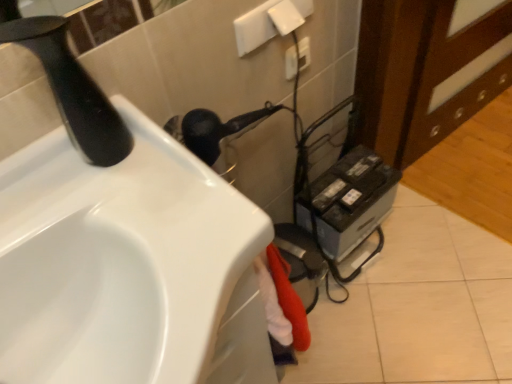
Question: From the image's perspective, is black matte faucet at upper left above white plastic electric outlet at upper center?

Choices:
 (A) yes
 (B) no

Answer: (B)

Question: From a real-world perspective, is black matte faucet at upper left located higher than white plastic electric outlet at upper center?

Choices:
 (A) no
 (B) yes

Answer: (B)

Question: Is black matte faucet at upper left looking in the opposite direction of white plastic electric outlet at upper center?

Choices:
 (A) yes
 (B) no

Answer: (B)

Question: Is the depth of black matte faucet at upper left less than that of white plastic electric outlet at upper center?

Choices:
 (A) no
 (B) yes

Answer: (B)

Question: Is black matte faucet at upper left to the left of white plastic electric outlet at upper center from the viewer's perspective?

Choices:
 (A) yes
 (B) no

Answer: (A)

Question: Would you say black matte faucet at upper left is a long distance from white plastic electric outlet at upper center?

Choices:
 (A) yes
 (B) no

Answer: (B)

Question: Considering the relative sizes of metallic gray printer at lower right and white glossy sink at lower left in the image provided, is metallic gray printer at lower right bigger than white glossy sink at lower left?

Choices:
 (A) yes
 (B) no

Answer: (B)

Question: Is metallic gray printer at lower right turned away from white glossy sink at lower left?

Choices:
 (A) no
 (B) yes

Answer: (A)

Question: Is metallic gray printer at lower right behind white glossy sink at lower left?

Choices:
 (A) no
 (B) yes

Answer: (B)

Question: Is metallic gray printer at lower right not close to white glossy sink at lower left?

Choices:
 (A) no
 (B) yes

Answer: (A)

Question: Could you tell me if metallic gray printer at lower right is facing white glossy sink at lower left?

Choices:
 (A) yes
 (B) no

Answer: (B)

Question: From the image's perspective, is metallic gray printer at lower right located beneath white glossy sink at lower left?

Choices:
 (A) yes
 (B) no

Answer: (B)

Question: Is metallic gray printer at lower right facing away from white plastic electric outlet at upper center?

Choices:
 (A) yes
 (B) no

Answer: (B)